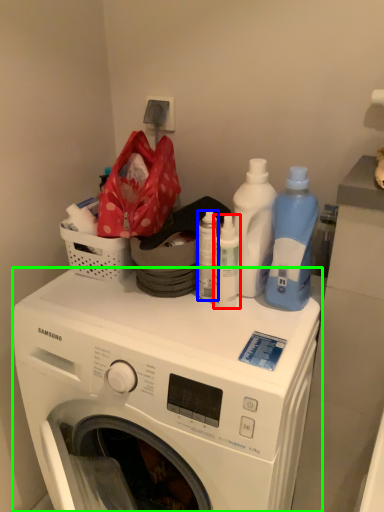
Question: Which object is positioned closest to cleaning product (highlighted by a red box)? Select from bottle (highlighted by a blue box) and washing machine (highlighted by a green box).

Choices:
 (A) bottle
 (B) washing machine

Answer: (A)